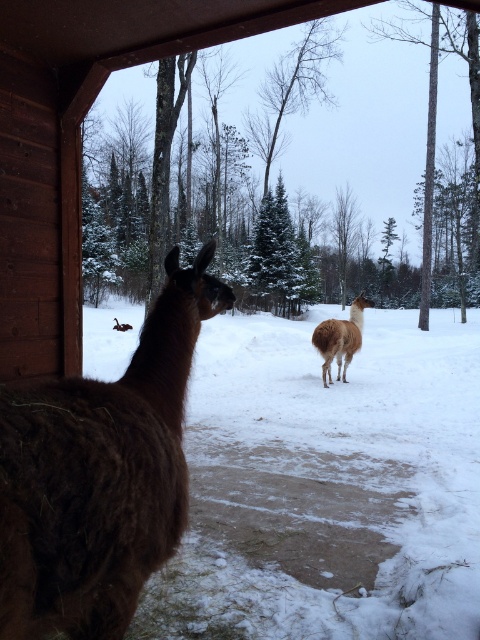
Question: Which of the following is the closest to the observer?

Choices:
 (A) brown fuzzy alpaca at left
 (B) brown woolly alpaca at center

Answer: (A)

Question: Among these points, which one is nearest to the camera?

Choices:
 (A) (343, 326)
 (B) (117, 426)

Answer: (B)

Question: Is brown fuzzy alpaca at left positioned behind brown woolly alpaca at center?

Choices:
 (A) yes
 (B) no

Answer: (B)

Question: Does brown fuzzy alpaca at left have a larger size compared to brown woolly alpaca at center?

Choices:
 (A) no
 (B) yes

Answer: (B)

Question: Is brown fuzzy alpaca at left wider than brown woolly alpaca at center?

Choices:
 (A) no
 (B) yes

Answer: (B)